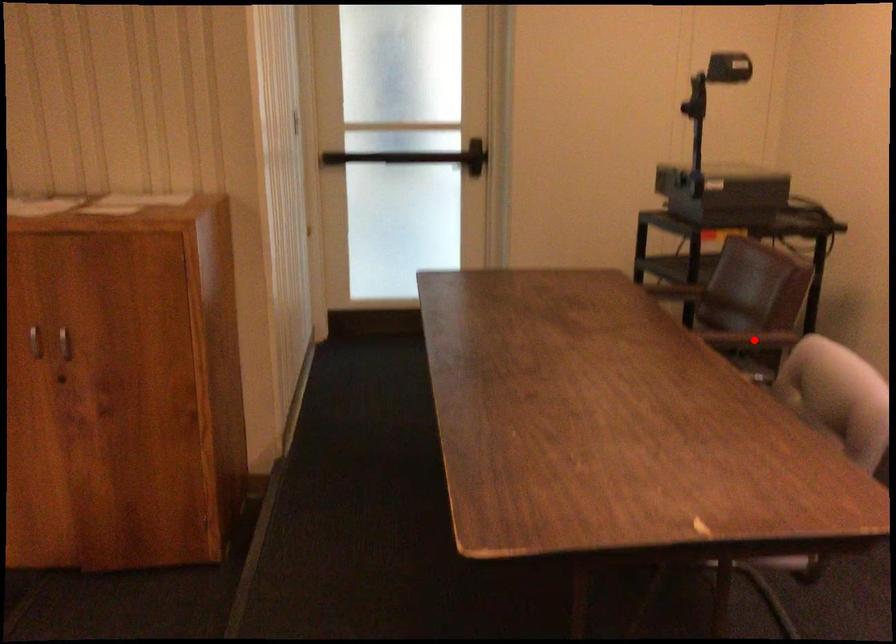
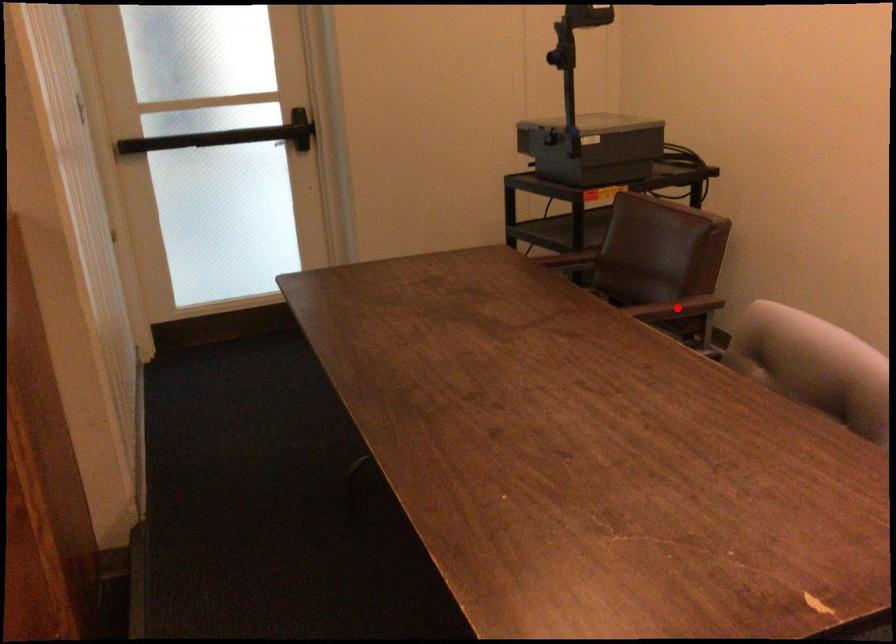
I am providing you with two images of the same scene from different viewpoints. A red point is marked on the first image and another point is marked on the second image. Are the points marked in image1 and image2 representing the same 3D position?

Yes